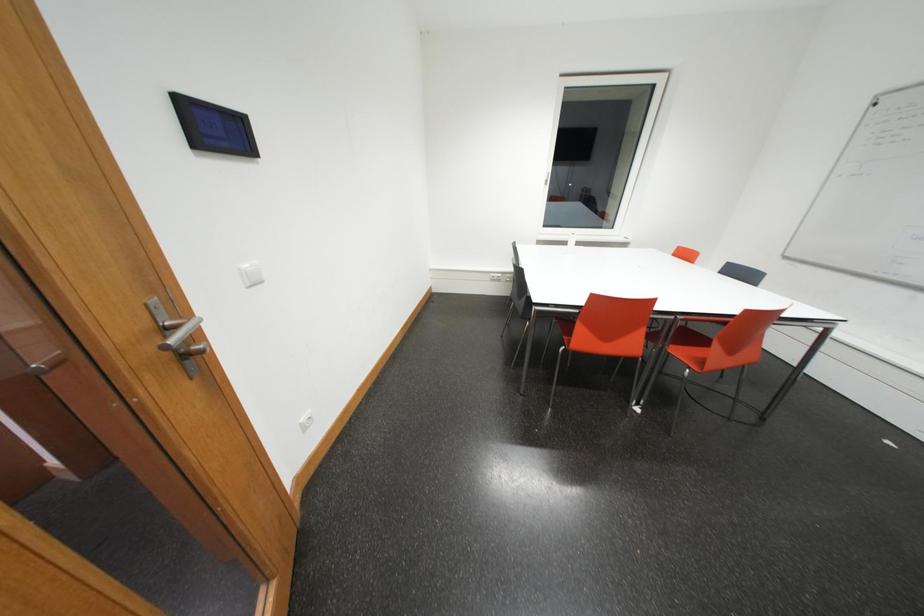
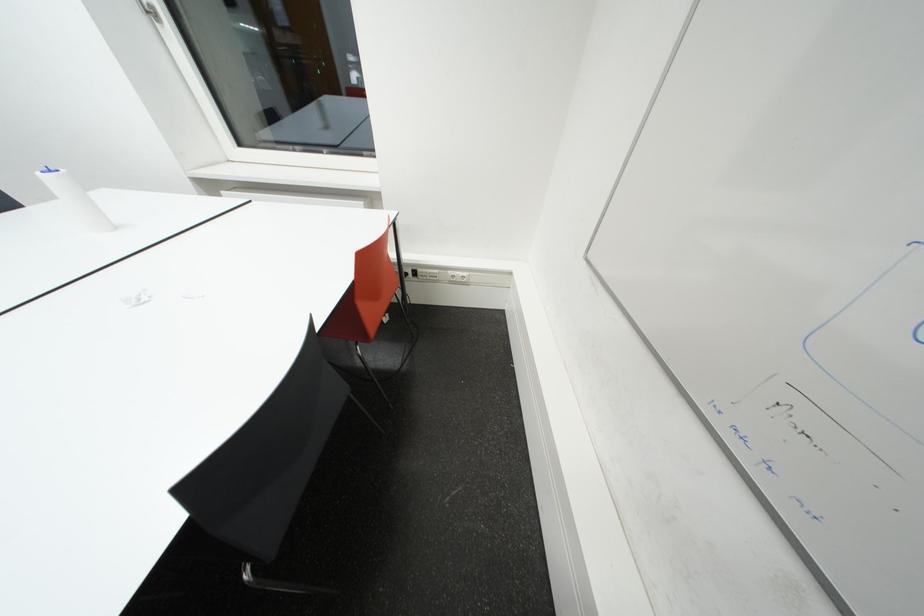
The images are taken continuously from a first-person perspective. In which direction are you moving?

The cameraman walked toward right, forward.